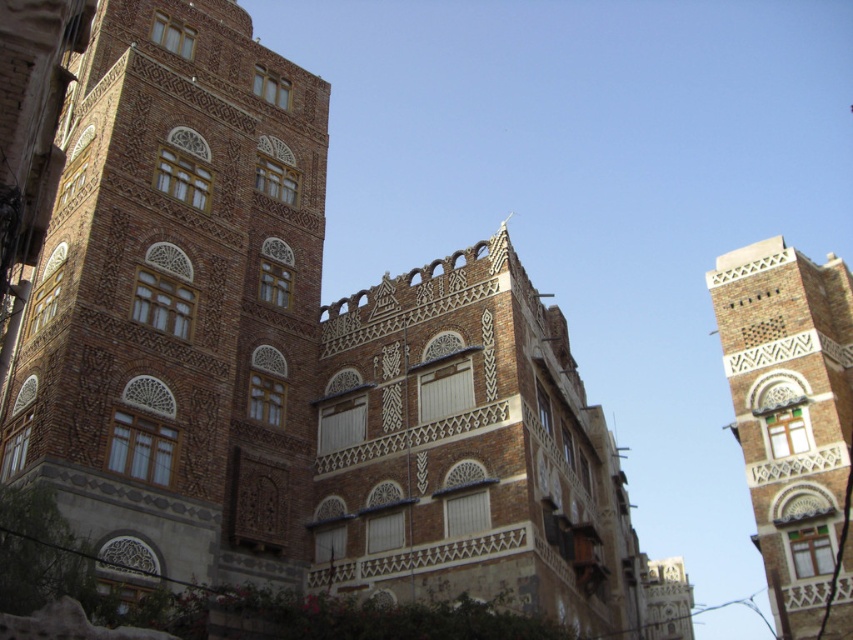
Can you confirm if brown textured building at center is thinner than brown textured tower at upper right?

Yes.

Who is shorter, brown textured building at center or brown textured tower at upper right?

With less height is brown textured building at center.

Is point (12, 428) farther from camera compared to point (744, 372)?

No.

Locate an element on the screen. brown textured building at center is located at coordinates (178, 301).